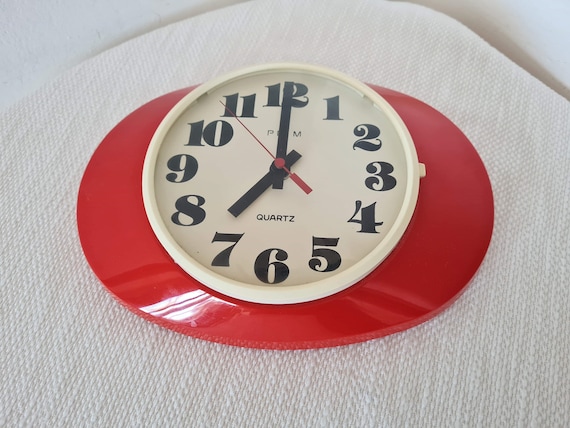
Locate an element on the screen. The width and height of the screenshot is (570, 428). 5" on clock face is located at coordinates (333, 254).